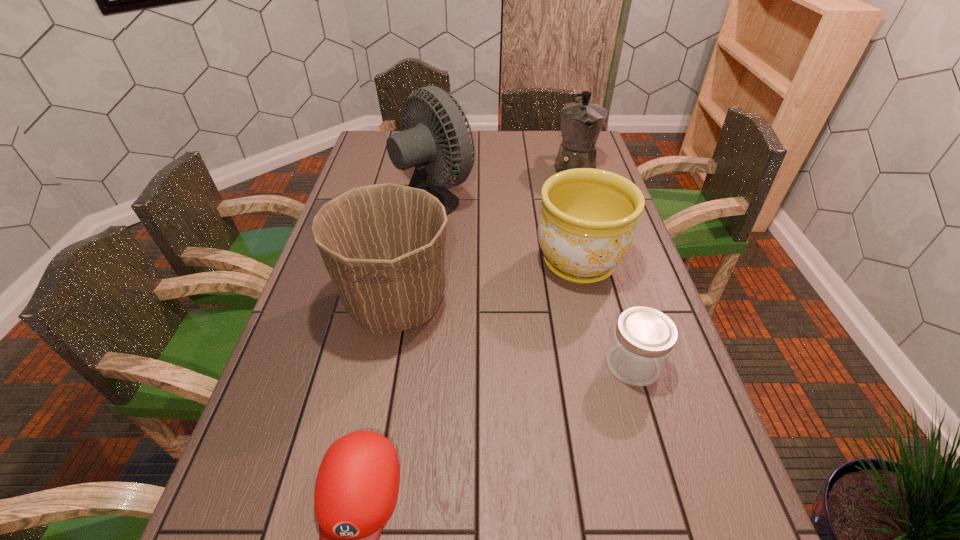
At what (x,y) coordinates should I click in order to perform the action: click on free space that satisfies the following two spatial constraints: 1. in front of the fan to direct airflow; 2. on the left side of the second shortest object. Please return your answer as a coordinate pair (x, y). The height and width of the screenshot is (540, 960). Looking at the image, I should click on (404, 364).

Where is `vacant space that satisfies the following two spatial constraints: 1. on the pouring side of the jar; 2. on the left side of the coffeepot`? The width and height of the screenshot is (960, 540). vacant space that satisfies the following two spatial constraints: 1. on the pouring side of the jar; 2. on the left side of the coffeepot is located at coordinates (633, 364).

Image resolution: width=960 pixels, height=540 pixels. In order to click on free location that satisfies the following two spatial constraints: 1. on the pouring side of the coffeepot; 2. in front of the fan to direct airflow in this screenshot , I will do `click(584, 199)`.

In order to click on vacant region that satisfies the following two spatial constraints: 1. on the front side of the fifth tallest object; 2. on the left side of the shorter flowerpot in this screenshot , I will do `click(603, 364)`.